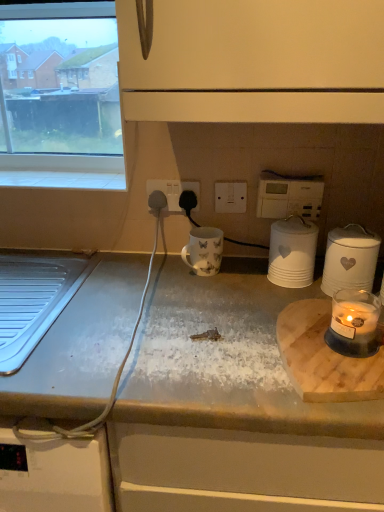
You are a GUI agent. You are given a task and a screenshot of the screen. Output one action in this format:
    pyautogui.click(x=<x>, y=<y>)
    Task: Click on the free space to the left of white glossy mug at center
    
    Given the screenshot: What is the action you would take?
    pyautogui.click(x=165, y=273)